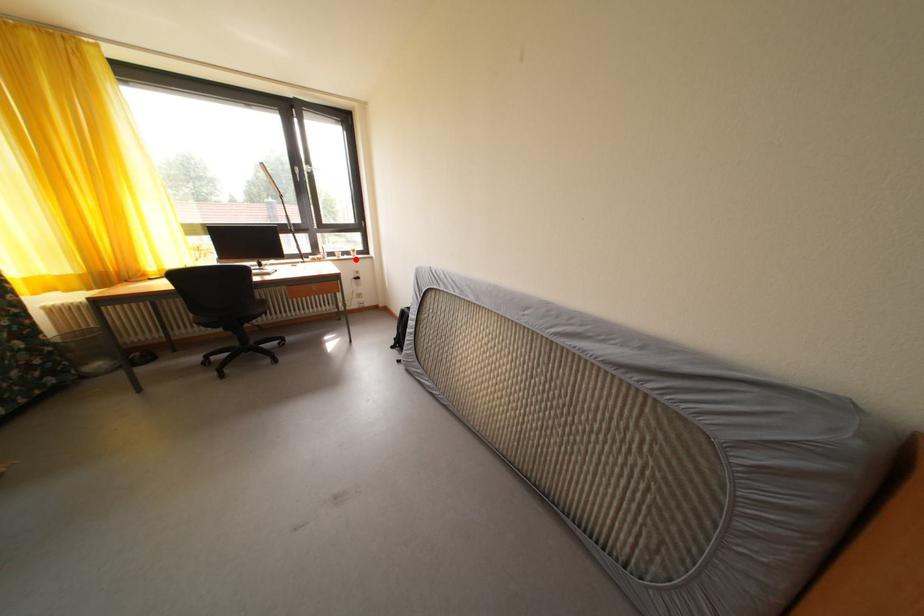
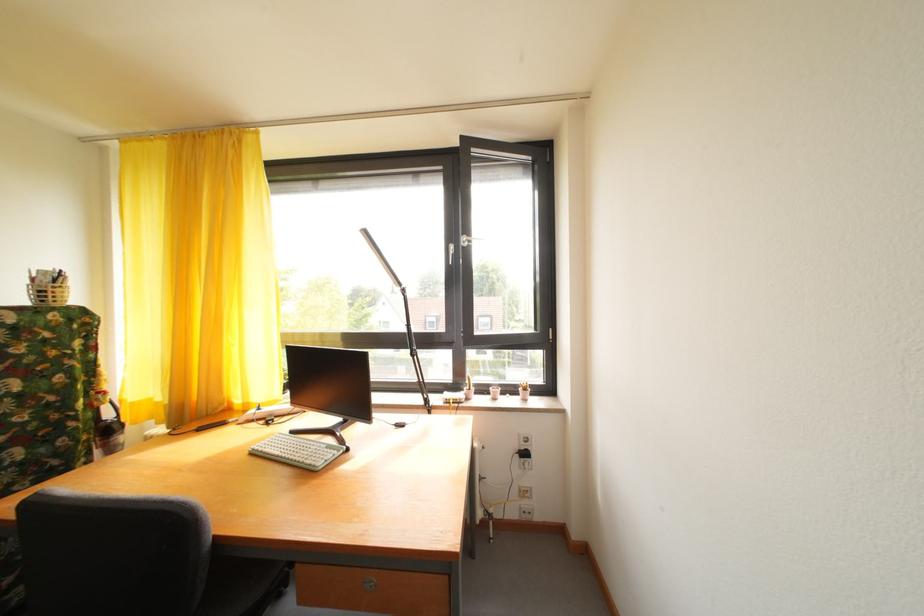
Question: A red point is marked in image1. In image2, is the corresponding 3D point closer to the camera or farther? Reply with the corresponding letter.

Choices:
 (A) The corresponding 3D point is closer.
 (B) The corresponding 3D point is farther.

Answer: (B)